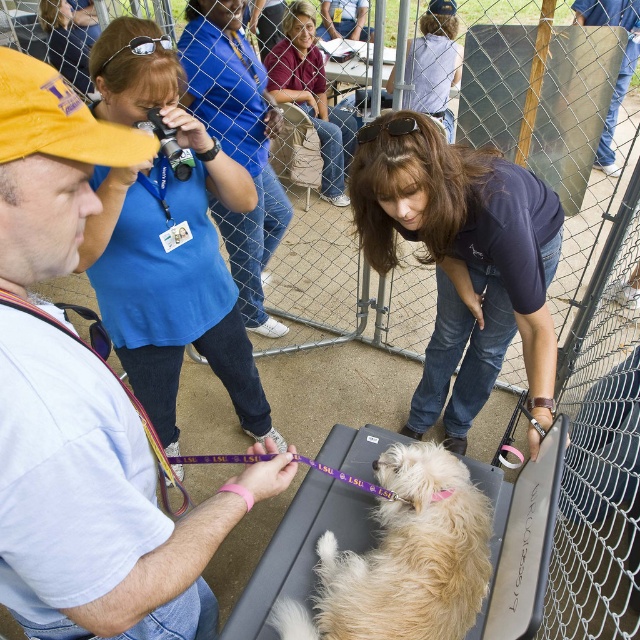
You are standing at the back of the scene and want to greet both the light blue shirt at left and the dark blue shirt at center. Which person should you approach first based on their positions?

You should approach the light blue shirt at left first because it is closer to you than the dark blue shirt at center, which is positioned above it.

You are at the community event and need to find the person with the wider blue shirt. Which one is it between the blue shirt at upper left and the matte blue shirt at upper center?

The matte blue shirt at upper center is wider than the blue shirt at upper left, so the wider one is the matte blue shirt at upper center.

You are standing at the center of the scene. Which direction should you move to reach the blue shirt at upper left?

The blue shirt at upper left is located at point 0.223 on the x and 0.370 on the y, so you should move towards the upper left direction to reach it.